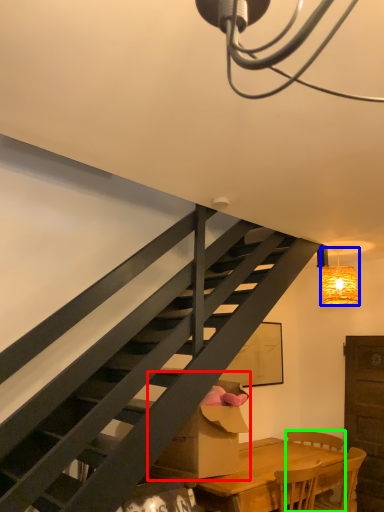
Question: Which object is positioned farthest from cardboard box (highlighted by a red box)? Select from lamp (highlighted by a blue box) and chair (highlighted by a green box).

Choices:
 (A) lamp
 (B) chair

Answer: (A)